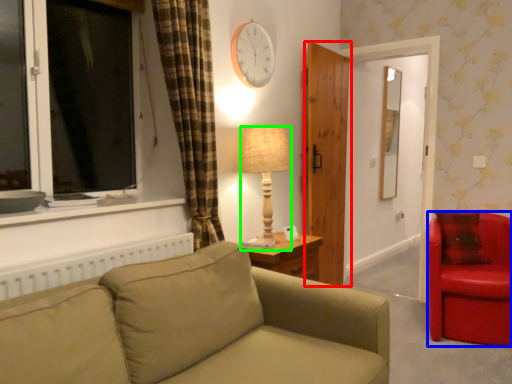
Question: Which is nearer to the door (highlighted by a red box)? chair (highlighted by a blue box) or lamp (highlighted by a green box).

Choices:
 (A) chair
 (B) lamp

Answer: (B)